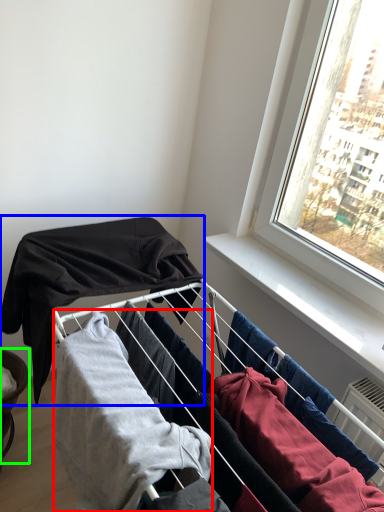
Question: Considering the real-world distances, which object is farthest from clothing (highlighted by a red box)? clothing (highlighted by a blue box) or furniture (highlighted by a green box)?

Choices:
 (A) clothing
 (B) furniture

Answer: (B)